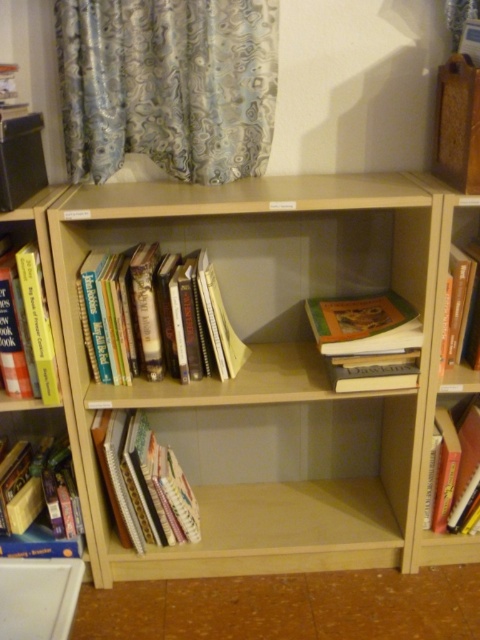
Is light brown wood bookcase at center to the right of hardcover book at lower right from the viewer's perspective?

Incorrect, light brown wood bookcase at center is not on the right side of hardcover book at lower right.

Between point (87, 410) and point (479, 445), which one is positioned in front?

Point (87, 410) is in front.

The image size is (480, 640). Find the location of `light brown wood bookcase at center`. light brown wood bookcase at center is located at coordinates (271, 371).

From the picture: Between light brown wood bookcase at center and hardcover book at right, which one appears on the left side from the viewer's perspective?

light brown wood bookcase at center is more to the left.

This screenshot has width=480, height=640. Identify the location of light brown wood bookcase at center. (271, 371).

From the picture: Does hardcover books at lower left appear over hardcover book at lower left?

Correct, hardcover books at lower left is located above hardcover book at lower left.

Measure the distance between point (104, 449) and camera.

Point (104, 449) is 4.57 feet from camera.

Between point (192, 509) and point (35, 458), which one is positioned in front?

Point (192, 509) is in front.

This screenshot has height=640, width=480. I want to click on hardcover books at lower left, so point(144,481).